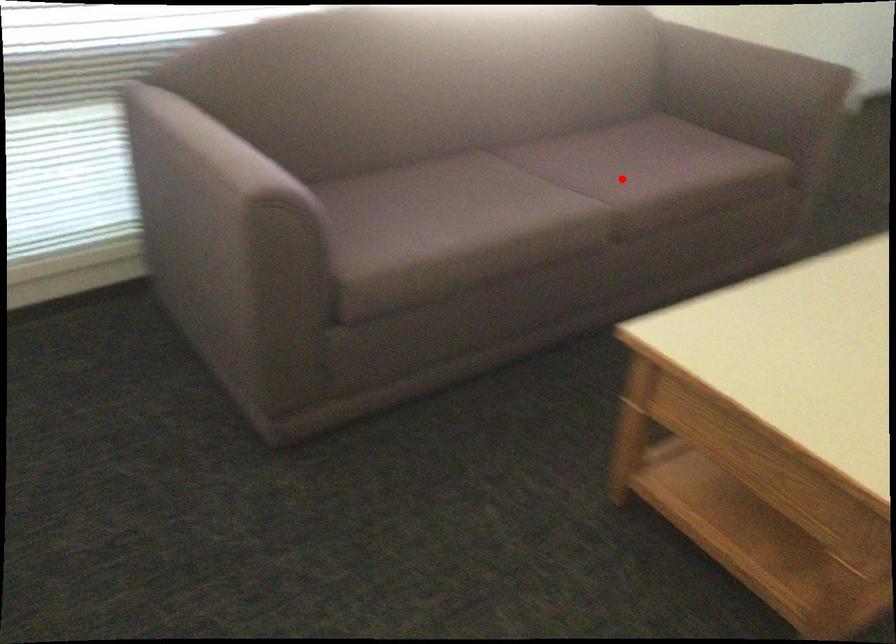
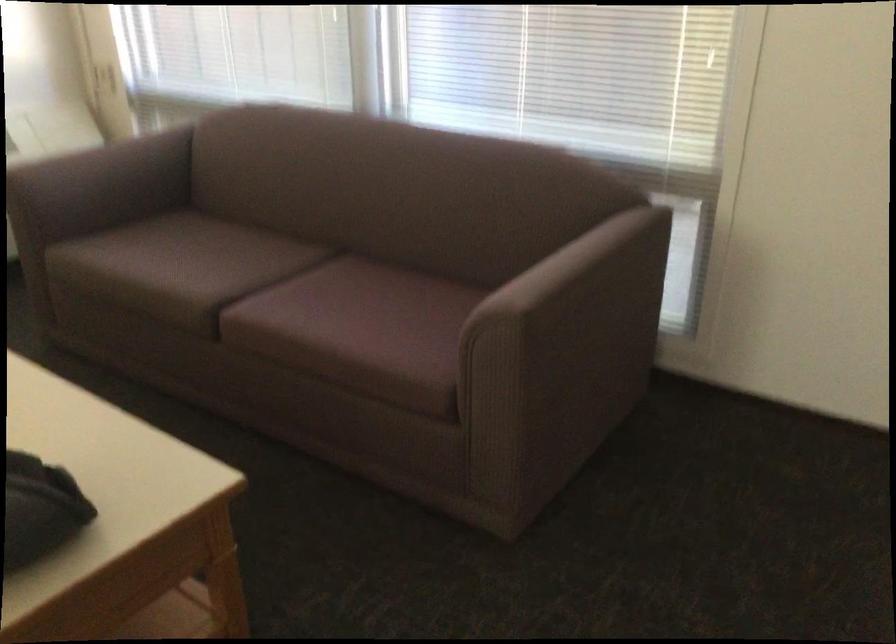
The point at the highlighted location is marked in the first image. Where is the corresponding point in the second image?

(277, 299)